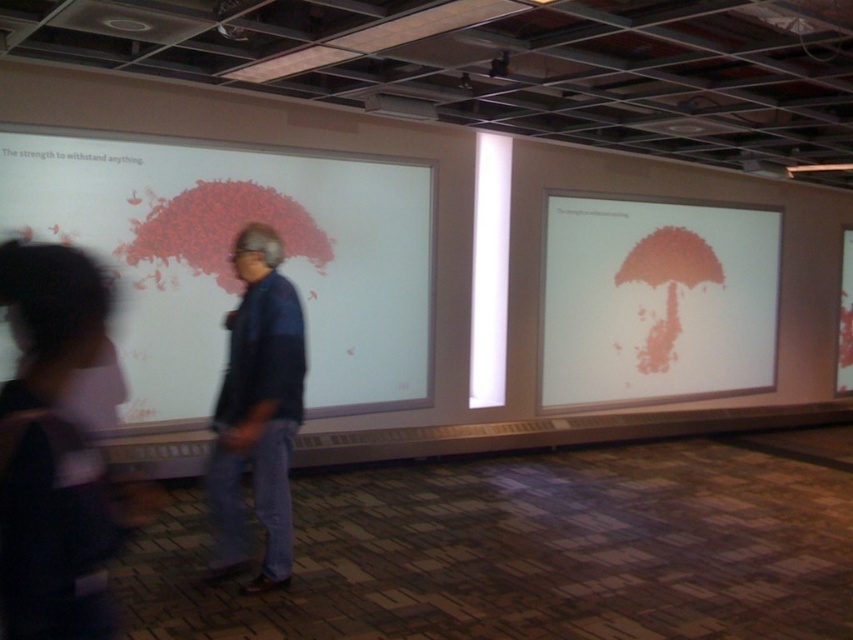
Question: Which point is farther to the camera?

Choices:
 (A) (68, 348)
 (B) (270, 408)
 (C) (627, 388)
 (D) (49, 180)

Answer: (C)

Question: Which object is closer to the camera taking this photo?

Choices:
 (A) matte red umbrella at center right
 (B) denim jacket at center
 (C) matte white board at upper left
 (D) dark blue jeans at center

Answer: (D)

Question: Among these objects, which one is nearest to the camera?

Choices:
 (A) matte red umbrella at center right
 (B) dark blue jeans at center
 (C) matte white board at upper left
 (D) denim jacket at center

Answer: (B)

Question: Is matte white board at upper left to the left of matte red umbrella at center right from the viewer's perspective?

Choices:
 (A) yes
 (B) no

Answer: (A)

Question: Can you confirm if matte red umbrella at center right is thinner than dark blue jeans at center?

Choices:
 (A) no
 (B) yes

Answer: (A)

Question: Can you confirm if matte white board at upper left is positioned above dark blue jeans at center?

Choices:
 (A) no
 (B) yes

Answer: (B)